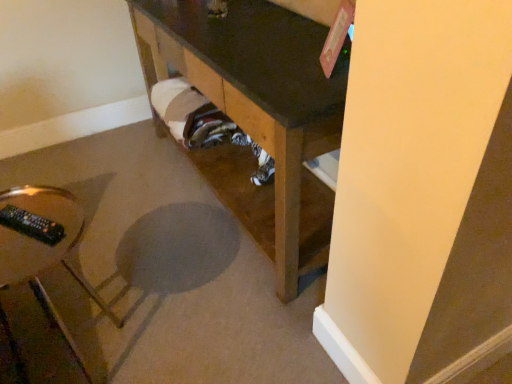
Question: Does point (301, 167) appear closer or farther from the camera than point (20, 294)?

Choices:
 (A) closer
 (B) farther

Answer: (A)

Question: Considering the relative positions of brown wood table at lower center, acting as the second furniture starting from the left, and clear glass remote control at lower left, arranged as the 2th furniture when viewed from the right, in the image provided, is brown wood table at lower center, acting as the second furniture starting from the left, to the left or to the right of clear glass remote control at lower left, arranged as the 2th furniture when viewed from the right,?

Choices:
 (A) left
 (B) right

Answer: (B)

Question: From the image's perspective, relative to clear glass remote control at lower left, the first furniture when ordered from left to right, is brown wood table at lower center, positioned as the 1th furniture in right-to-left order, above or below?

Choices:
 (A) below
 (B) above

Answer: (B)

Question: In terms of height, does clear glass remote control at lower left, arranged as the 2th furniture when viewed from the right, look taller or shorter compared to brown wood table at lower center, positioned as the 1th furniture in right-to-left order?

Choices:
 (A) tall
 (B) short

Answer: (B)

Question: Considering the positions of clear glass remote control at lower left, arranged as the 2th furniture when viewed from the right, and brown wood table at lower center, positioned as the 1th furniture in right-to-left order, in the image, is clear glass remote control at lower left, arranged as the 2th furniture when viewed from the right, bigger or smaller than brown wood table at lower center, positioned as the 1th furniture in right-to-left order,?

Choices:
 (A) big
 (B) small

Answer: (B)

Question: In the image, is clear glass remote control at lower left, the first furniture when ordered from left to right, positioned in front of or behind brown wood table at lower center, positioned as the 1th furniture in right-to-left order?

Choices:
 (A) behind
 (B) front

Answer: (B)

Question: Does point [x=66, y=221] appear closer or farther from the camera than point [x=287, y=221]?

Choices:
 (A) closer
 (B) farther

Answer: (A)